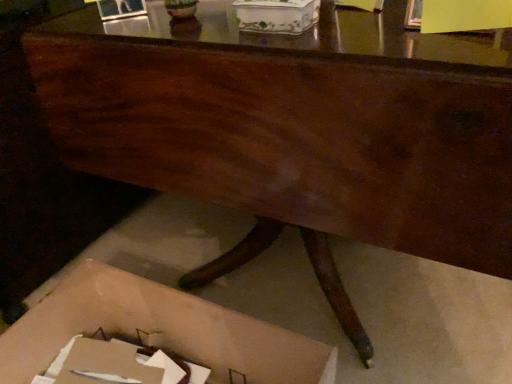
This screenshot has width=512, height=384. I want to click on free space in front of porcelain floral box at center, positioned as the second storage box in bottom-to-top order, so click(x=320, y=44).